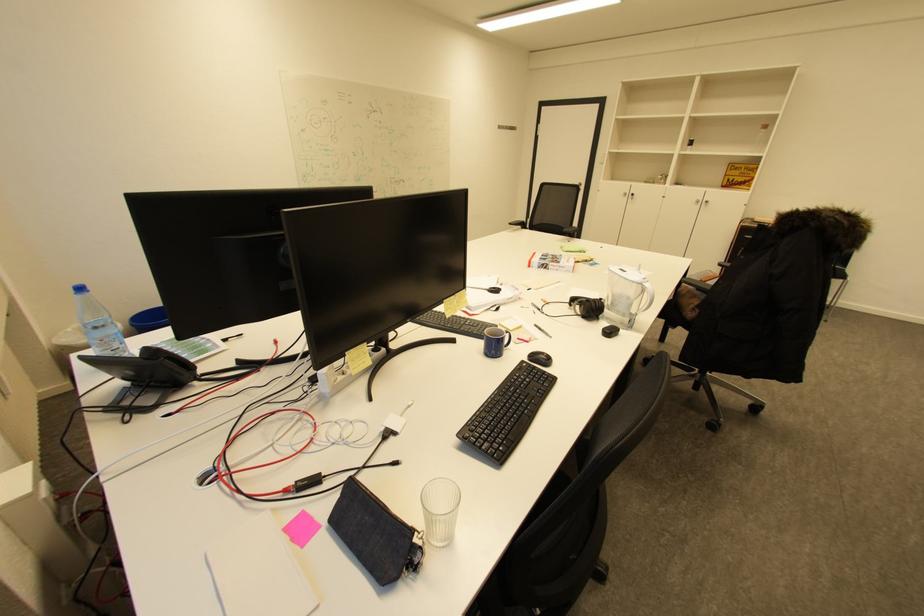
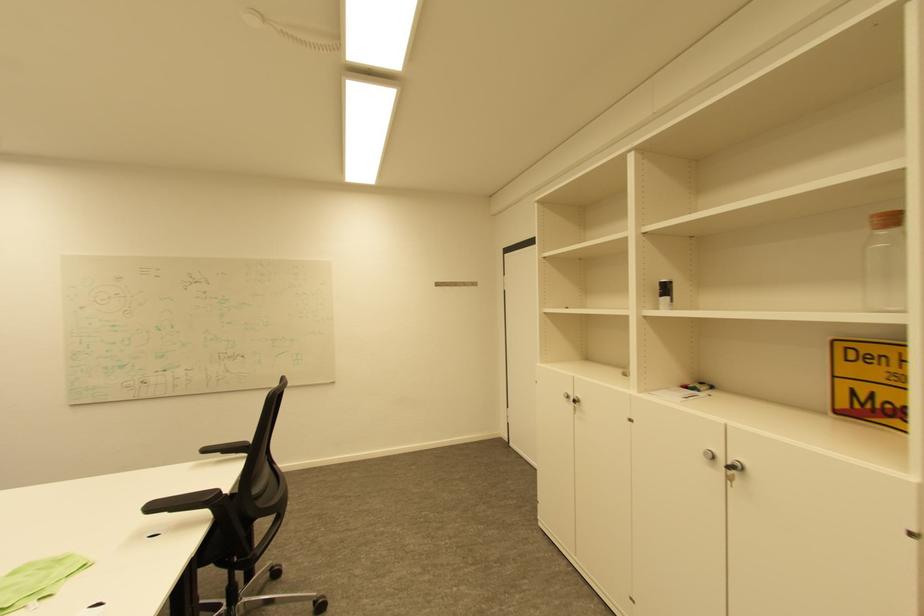
In the second image, find the point that corresponds to pixel 696 147 in the first image.

(667, 296)